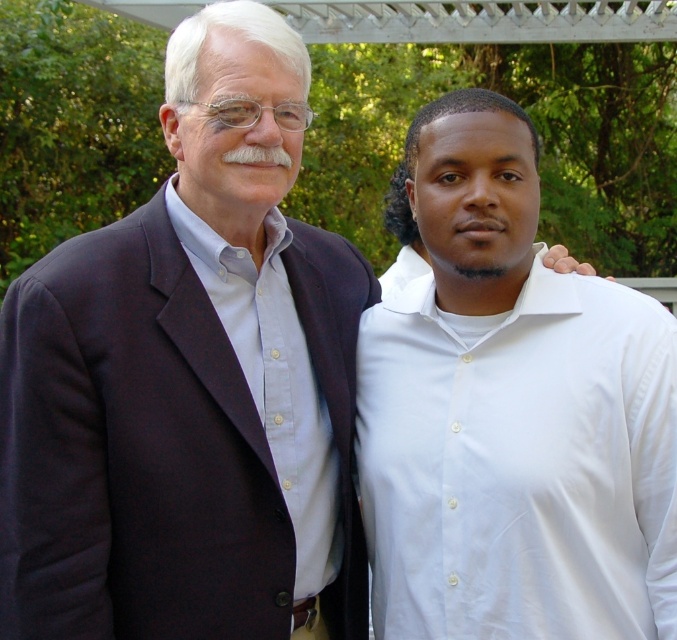
Can you confirm if dark blue fabric business suit at left is thinner than light blue cotton shirt at left?

In fact, dark blue fabric business suit at left might be wider than light blue cotton shirt at left.

Does dark blue fabric business suit at left have a larger size compared to light blue cotton shirt at left?

Correct, dark blue fabric business suit at left is larger in size than light blue cotton shirt at left.

This screenshot has height=640, width=677. What are the coordinates of `dark blue fabric business suit at left` in the screenshot? It's located at (131, 452).

Does dark blue fabric business suit at left have a lesser height compared to white smooth shirt at right?

No, dark blue fabric business suit at left is not shorter than white smooth shirt at right.

Can you confirm if dark blue fabric business suit at left is wider than white smooth shirt at right?

Indeed, dark blue fabric business suit at left has a greater width compared to white smooth shirt at right.

Measure the distance between dark blue fabric business suit at left and camera.

dark blue fabric business suit at left is 6.90 feet from camera.

The width and height of the screenshot is (677, 640). Find the location of `dark blue fabric business suit at left`. dark blue fabric business suit at left is located at coordinates (131, 452).

Between white smooth shirt at right and light blue cotton shirt at left, which one appears on the right side from the viewer's perspective?

white smooth shirt at right

Does white smooth shirt at right appear under light blue cotton shirt at left?

Indeed, white smooth shirt at right is positioned under light blue cotton shirt at left.

The width and height of the screenshot is (677, 640). Describe the element at coordinates (519, 464) in the screenshot. I see `white smooth shirt at right` at that location.

Image resolution: width=677 pixels, height=640 pixels. Find the location of `white smooth shirt at right`. white smooth shirt at right is located at coordinates (519, 464).